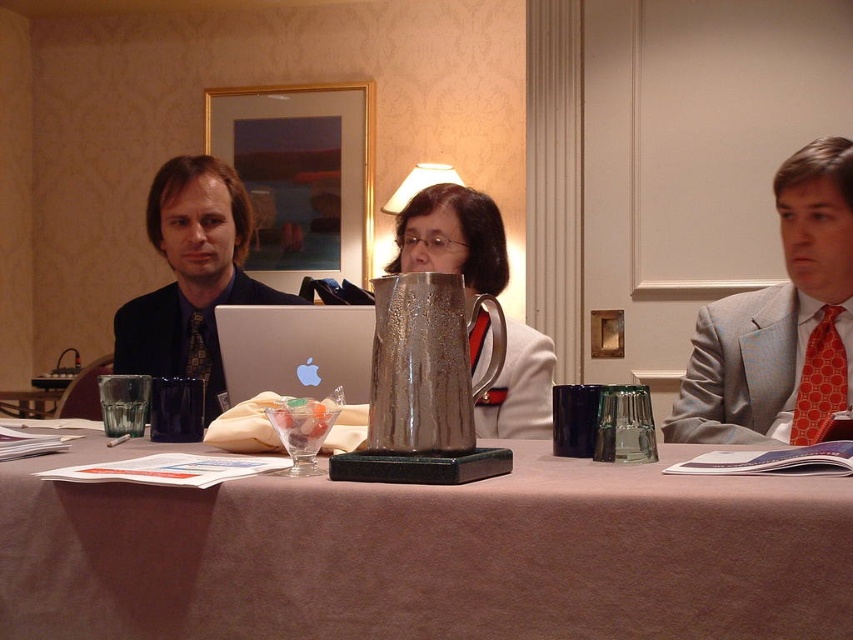
You are a guest entering the meeting room and need to pour water from the silver textured pitcher at center into your glass. However, there is a light gray suit at right nearby. Is the pitcher tall enough to avoid spilling water onto the suit?

The silver textured pitcher at center is taller than the light gray suit at right, so pouring water from it should not spill onto the suit as the pitcher is taller and can be handled without obstruction.

You are a guest at this meeting and need to pour water from the silver textured pitcher at center into the light gray suit at right. Is the pitcher large enough to cover the entire suit when poured?

The silver textured pitcher at center is bigger than the light gray suit at right, so pouring water from the pitcher could potentially cover the entire suit since the pitcher is larger in size.